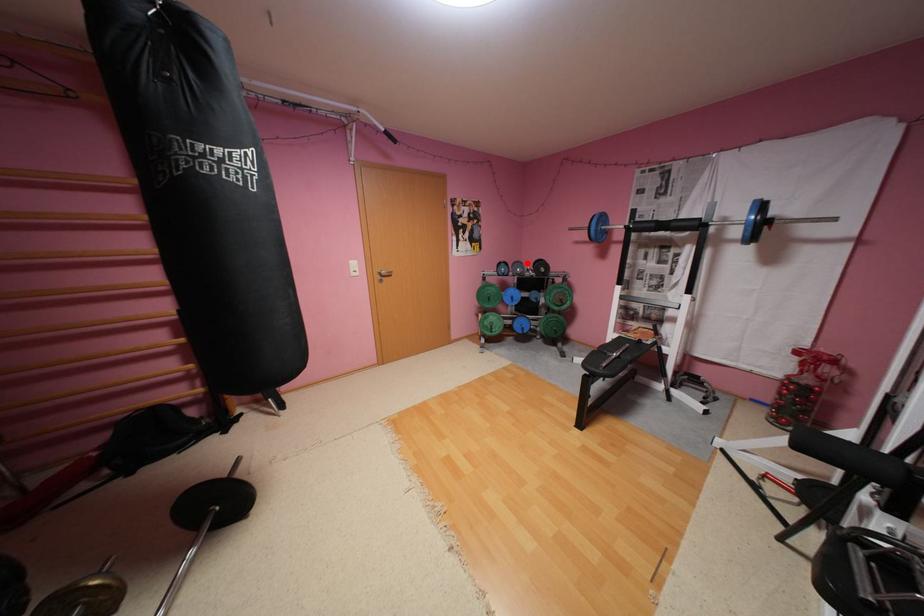
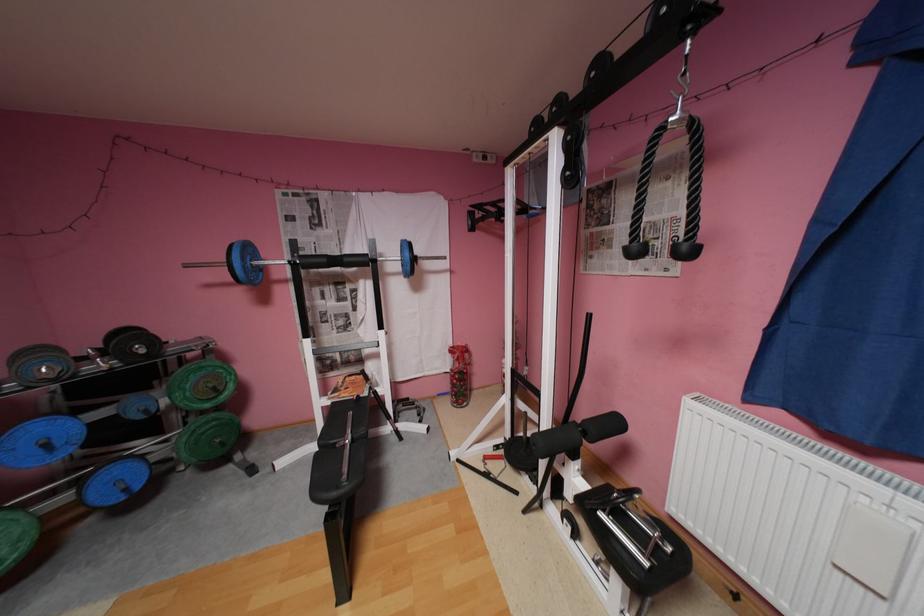
Find the pixel in the second image that matches the highlighted location in the first image.

(49, 351)